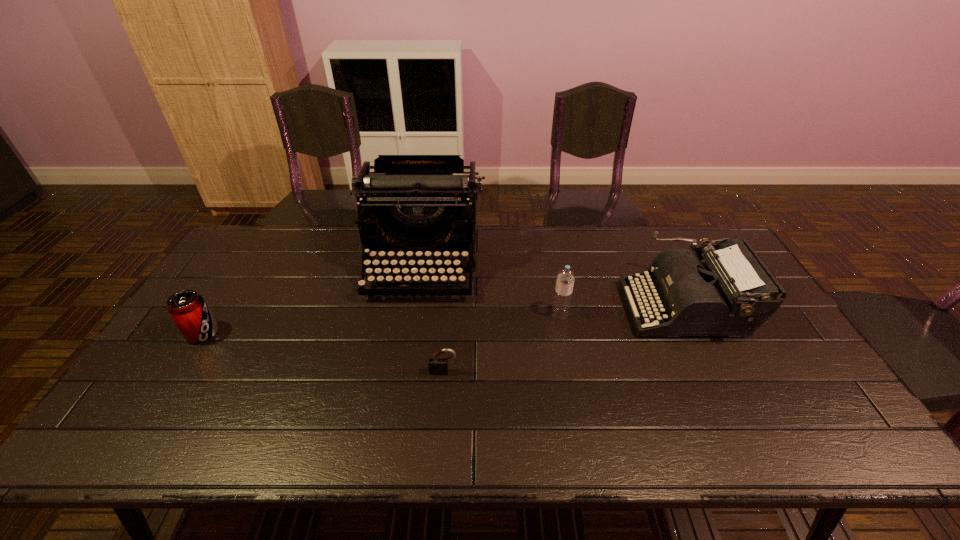
I want to click on free location located 0.180m on the front of the water bottle, so click(x=570, y=371).

Locate an element on the screen. The image size is (960, 540). vacant area situated 0.090m on the front-facing side of the rightmost object is located at coordinates (595, 307).

I want to click on vacant point located on the front-facing side of the rightmost object, so click(x=516, y=307).

You are a GUI agent. You are given a task and a screenshot of the screen. Output one action in this format:
    pyautogui.click(x=<x>, y=<y>)
    Task: Click on the free spot located 0.400m on the front-facing side of the rightmost object
    The width and height of the screenshot is (960, 540).
    Given the screenshot: What is the action you would take?
    pyautogui.click(x=492, y=307)

Identify the location of free spot located 0.230m on the right of the second shortest object. (300, 334).

Where is `free space located with the keyhole on the front of the nearest object`? The height and width of the screenshot is (540, 960). free space located with the keyhole on the front of the nearest object is located at coordinates (442, 392).

The height and width of the screenshot is (540, 960). In order to click on object present at the far edge in this screenshot , I will do 413,202.

Locate an element on the screen. The height and width of the screenshot is (540, 960). object present at the left edge is located at coordinates (188, 309).

This screenshot has height=540, width=960. What are the coordinates of `object located in the right edge section of the desktop` in the screenshot? It's located at (733, 293).

Where is `vacant space at the far edge of the desktop`? The height and width of the screenshot is (540, 960). vacant space at the far edge of the desktop is located at coordinates (346, 255).